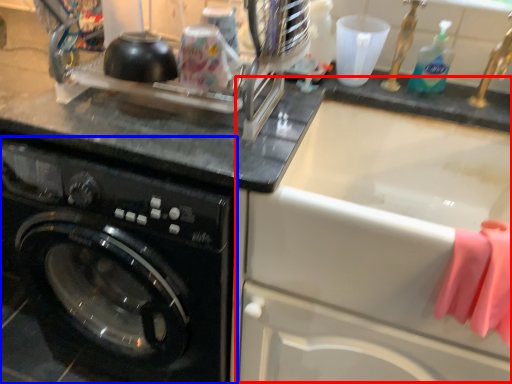
Question: Which point is further to the camera, sink (highlighted by a red box) or washing machine (highlighted by a blue box)?

Choices:
 (A) sink
 (B) washing machine

Answer: (B)